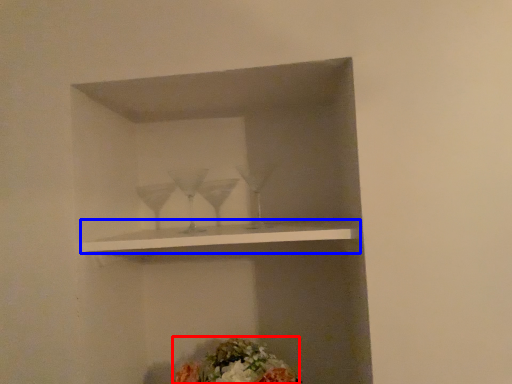
Question: Among these objects, which one is farthest to the camera, flower (highlighted by a red box) or shelf (highlighted by a blue box)?

Choices:
 (A) flower
 (B) shelf

Answer: (A)